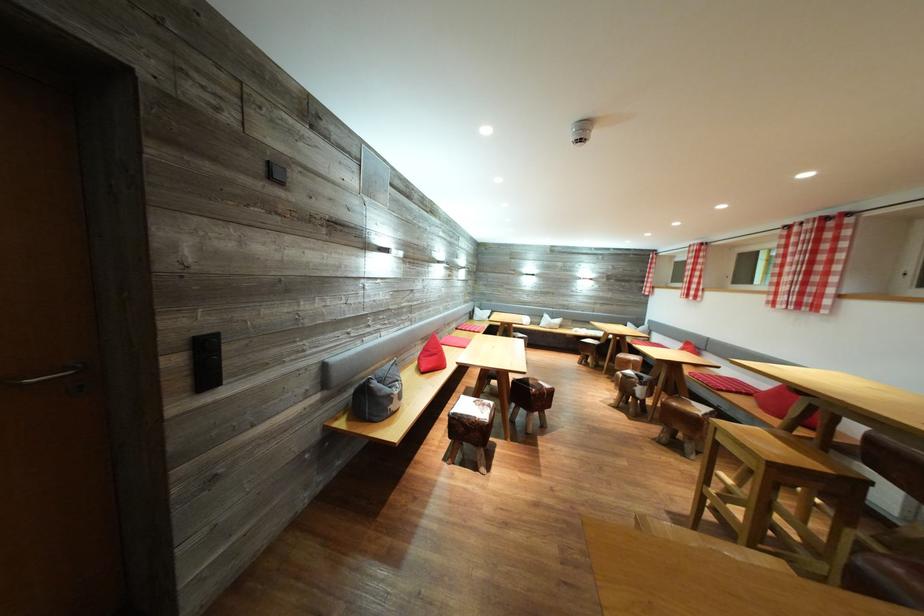
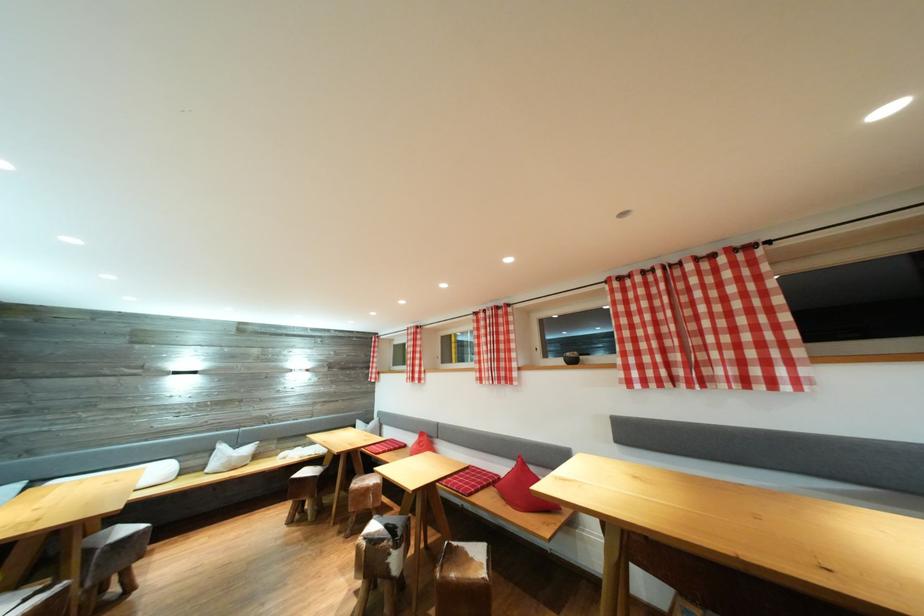
Locate, in the second image, the point that corresponds to point (808, 299) in the first image.

(505, 374)